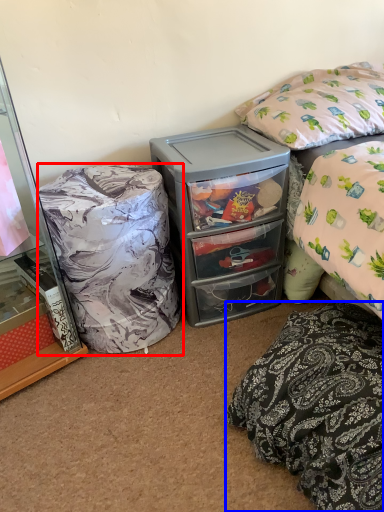
Question: Among these objects, which one is nearest to the camera, bean bag chair (highlighted by a red box) or pillow (highlighted by a blue box)?

Choices:
 (A) bean bag chair
 (B) pillow

Answer: (B)